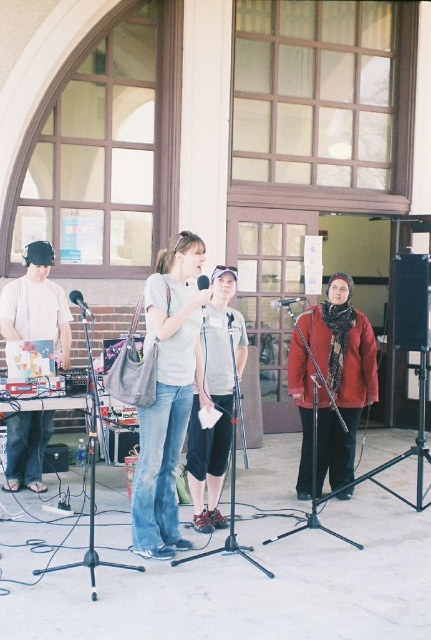
Question: Is red woolen scarf at center below matte white headphones at left?

Choices:
 (A) yes
 (B) no

Answer: (A)

Question: Which object is positioned farthest from the red woolen scarf at center?

Choices:
 (A) matte black microphone at center
 (B) matte white headphones at left
 (C) matte gray shirt at center

Answer: (A)

Question: Does red woolen scarf at center appear over matte white headphones at left?

Choices:
 (A) yes
 (B) no

Answer: (B)

Question: From the image, what is the correct spatial relationship of red woolen scarf at center in relation to matte black microphone at center?

Choices:
 (A) above
 (B) below

Answer: (B)

Question: Which point is closer to the camera taking this photo?

Choices:
 (A) (278, 307)
 (B) (187, 381)

Answer: (B)

Question: Which object is positioned closest to the metallic silver microphone at center?

Choices:
 (A) denim jeans at center
 (B) matte black microphone at center
 (C) red woolen scarf at center

Answer: (C)